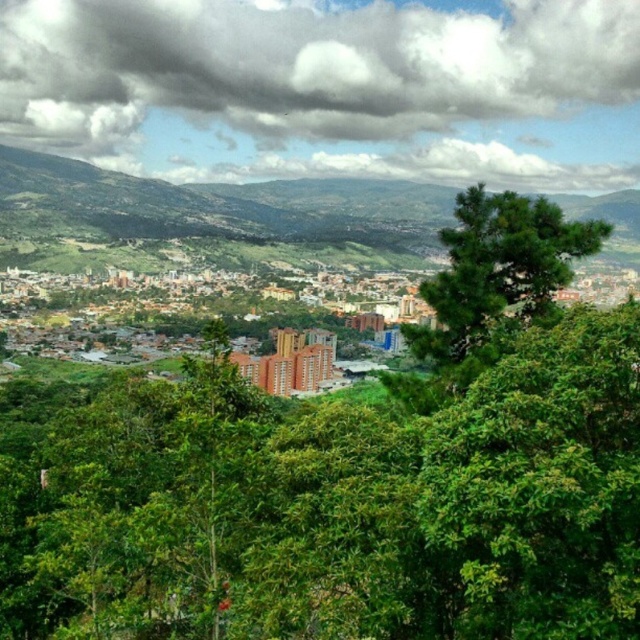
Question: Does brown brick buildings at center appear over green leafy tree at center-right?

Choices:
 (A) no
 (B) yes

Answer: (A)

Question: Which is farther from the cloudy sky at upper center?

Choices:
 (A) green leafy tree at center
 (B) brown brick buildings at center

Answer: (A)

Question: Which object is positioned closest to the green leafy tree at center-right?

Choices:
 (A) green leafy tree at center
 (B) brown brick buildings at center
 (C) cloudy sky at upper center

Answer: (B)

Question: Does cloudy sky at upper center have a larger size compared to green leafy tree at center-right?

Choices:
 (A) no
 (B) yes

Answer: (B)

Question: From the image, what is the correct spatial relationship of brown brick buildings at center in relation to green leafy tree at center-right?

Choices:
 (A) above
 (B) below

Answer: (B)

Question: Which of these objects is positioned closest to the brown brick buildings at center?

Choices:
 (A) green leafy tree at center
 (B) green leafy tree at center-right

Answer: (B)